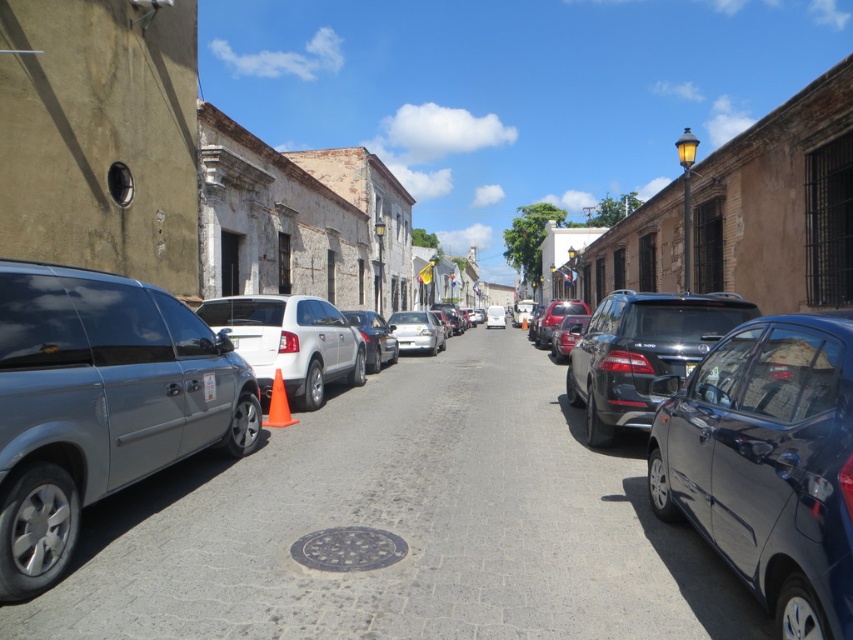
You are a delivery driver who needs to park your 1.5m wide delivery van on this narrow street. There is a satin silver van at left. Can you safely park your van next to it without blocking the traffic cone?

The satin silver van at left is located at point (99, 403). Since the delivery van is 1.5m wide, it may not be possible to park safely next to it without blocking the traffic cone, as the exact spacing and available space aren

You are standing at the end of the street and want to take a photo that includes both point (170,445) and point (814,637). Which point should you focus on first to ensure both are in focus?

You should focus on point (170,445) first because it is closer to the camera than point (814,637). This ensures that both points will be in focus as the closer point sets the focal plane.